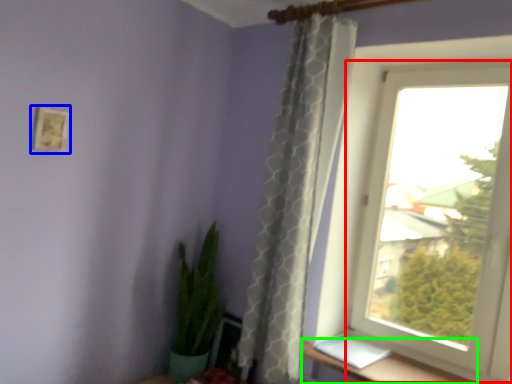
Question: Based on their relative distances, which object is nearer to window (highlighted by a red box)? Choose from picture frame (highlighted by a blue box) and window sill (highlighted by a green box).

Choices:
 (A) picture frame
 (B) window sill

Answer: (B)